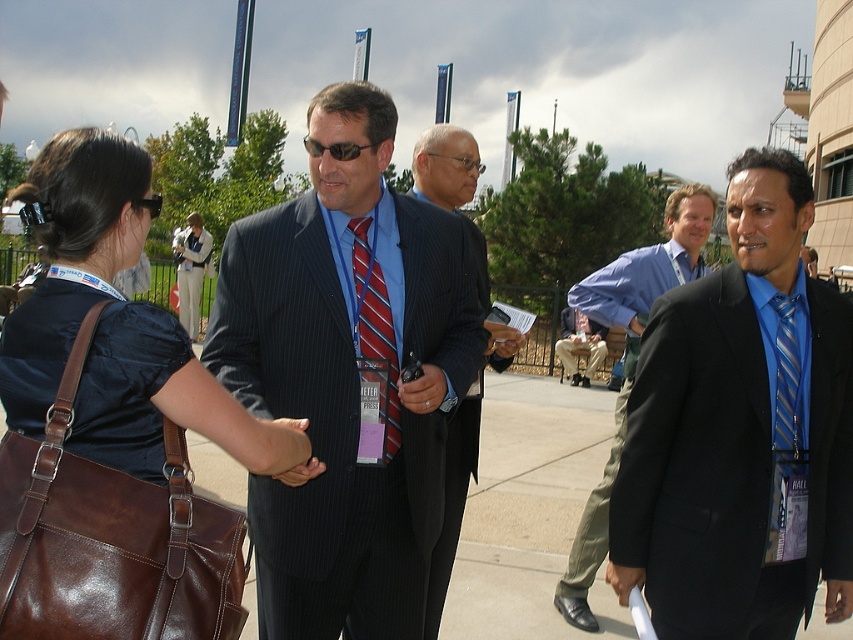
Can you confirm if blue silk suit at center is taller than blue striped tie at right?

Yes.

Is blue silk suit at center bigger than blue striped tie at right?

Correct, blue silk suit at center is larger in size than blue striped tie at right.

The width and height of the screenshot is (853, 640). Describe the element at coordinates (628, 362) in the screenshot. I see `blue silk suit at center` at that location.

You are a GUI agent. You are given a task and a screenshot of the screen. Output one action in this format:
    pyautogui.click(x=<x>, y=<y>)
    Task: Click on the blue silk suit at center
    
    Given the screenshot: What is the action you would take?
    pyautogui.click(x=628, y=362)

This screenshot has width=853, height=640. What do you see at coordinates (628, 362) in the screenshot? I see `blue silk suit at center` at bounding box center [628, 362].

Can you confirm if blue silk suit at center is taller than striped fabric tie at center?

Correct, blue silk suit at center is much taller as striped fabric tie at center.

Find the location of a particular element. This screenshot has width=853, height=640. blue silk suit at center is located at coordinates (628, 362).

Between matte black suit at center and brown leather bag at center, which one appears on the left side from the viewer's perspective?

brown leather bag at center is more to the left.

Is matte black suit at center further to camera compared to brown leather bag at center?

Yes, it is.

Who is more distant from viewer, (x=387, y=156) or (x=74, y=429)?

The point (x=387, y=156) is behind.

Where is `matte black suit at center`? matte black suit at center is located at coordinates pyautogui.click(x=346, y=376).